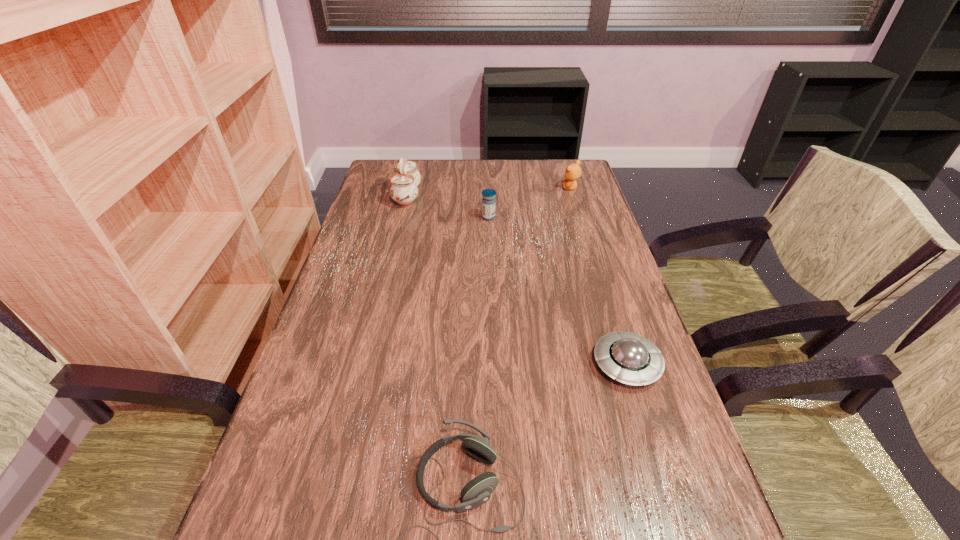
Locate an element on the screen. vacant area situated on the front of the second nearest object is located at coordinates (674, 518).

This screenshot has height=540, width=960. In order to click on chinaware situated at the far edge in this screenshot , I will do `click(404, 191)`.

Identify the location of teddy bear at the far edge. The height and width of the screenshot is (540, 960). (573, 171).

Where is `object present at the left edge`? The height and width of the screenshot is (540, 960). object present at the left edge is located at coordinates (404, 191).

I want to click on teddy bear located in the right edge section of the desktop, so click(x=573, y=171).

The width and height of the screenshot is (960, 540). Identify the location of saucer at the right edge. (631, 359).

The image size is (960, 540). Identify the location of object located in the far left corner section of the desktop. point(404,191).

Locate an element on the screen. The image size is (960, 540). object that is at the far right corner is located at coordinates (573, 171).

Where is `vacant space at the far edge`? vacant space at the far edge is located at coordinates (445, 181).

This screenshot has width=960, height=540. Find the location of `vacant area at the left edge`. vacant area at the left edge is located at coordinates (344, 312).